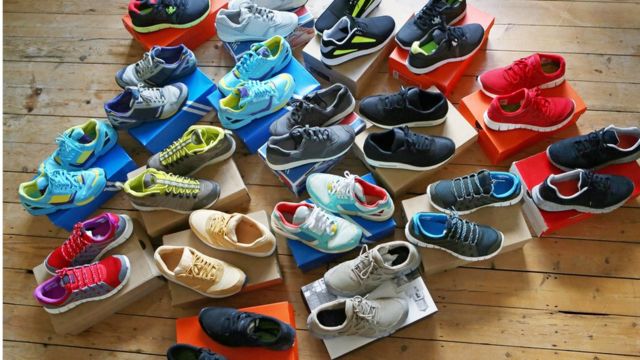
Locate an element on the screen. natural plain cardboard shoeboxes is located at coordinates (138, 264), (240, 179), (259, 267), (512, 221), (463, 135), (352, 71).